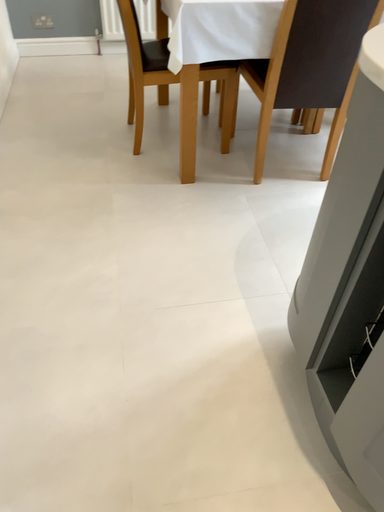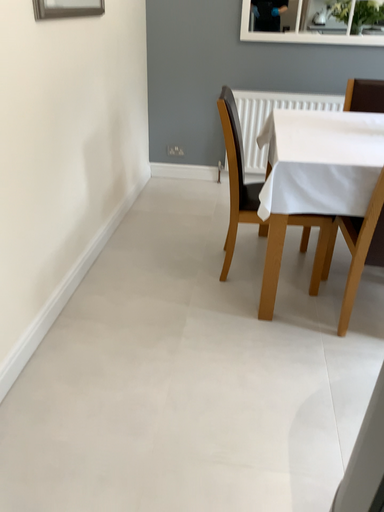
Question: Which way did the camera rotate in the video?

Choices:
 (A) rotated downward
 (B) rotated upward

Answer: (B)